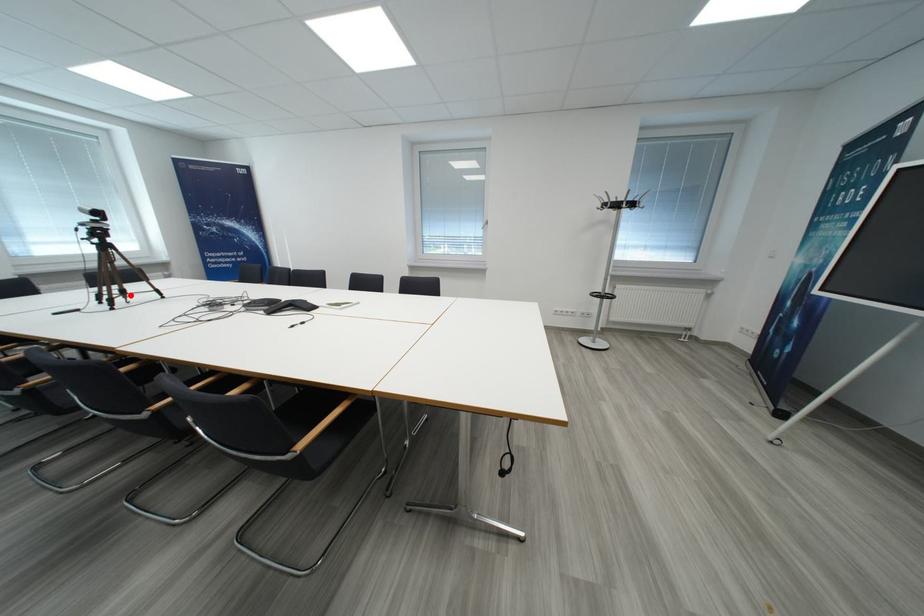
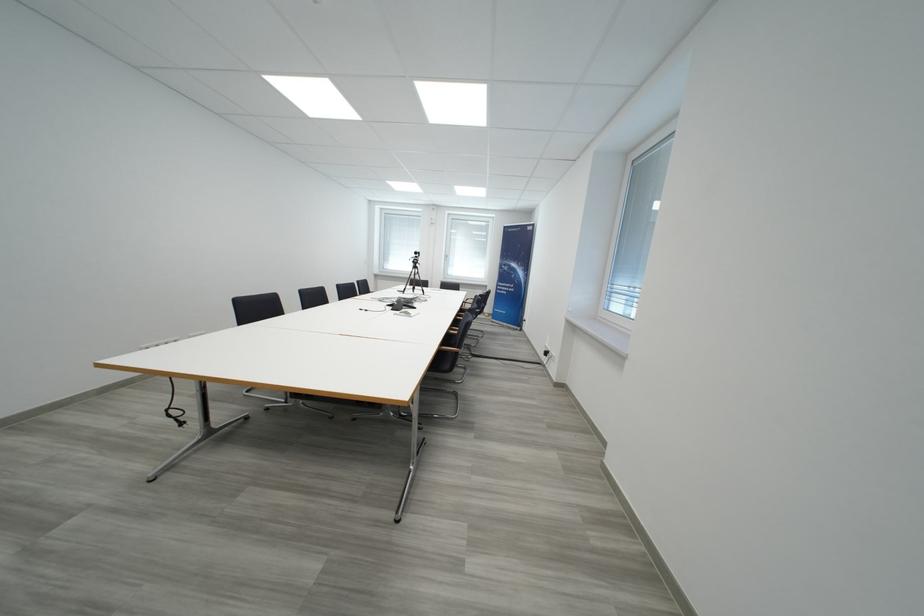
Locate, in the second image, the point that corresponds to the highlighted location in the first image.

(420, 291)